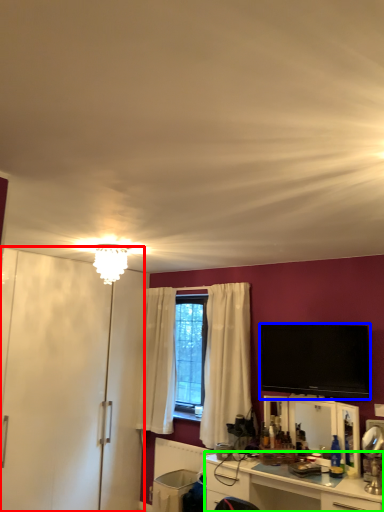
Question: Which object is positioned farthest from armoire (highlighted by a red box)? Select from television (highlighted by a blue box) and cabinetry (highlighted by a green box).

Choices:
 (A) television
 (B) cabinetry

Answer: (A)